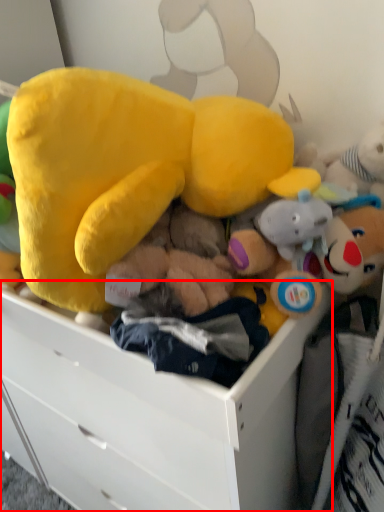
Question: From the image's perspective, where is drawer (annotated by the red box) located in relation to toy in the image?

Choices:
 (A) below
 (B) above

Answer: (A)